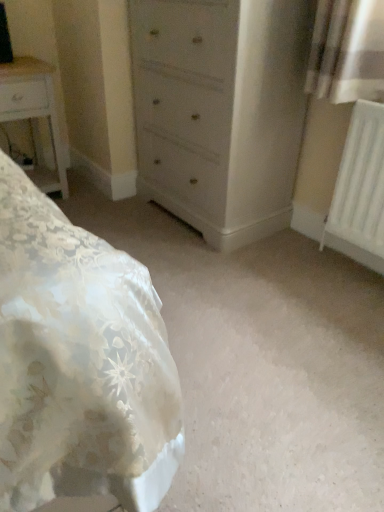
Question: From a real-world perspective, is white glossy nightstand at left below white plastic radiator at right?

Choices:
 (A) no
 (B) yes

Answer: (B)

Question: From the image's perspective, is white glossy nightstand at left under white plastic radiator at right?

Choices:
 (A) yes
 (B) no

Answer: (B)

Question: Considering the relative sizes of white glossy nightstand at left and white plastic radiator at right in the image provided, is white glossy nightstand at left bigger than white plastic radiator at right?

Choices:
 (A) yes
 (B) no

Answer: (A)

Question: Is white glossy nightstand at left outside white plastic radiator at right?

Choices:
 (A) no
 (B) yes

Answer: (B)

Question: Is white glossy nightstand at left smaller than white plastic radiator at right?

Choices:
 (A) yes
 (B) no

Answer: (B)

Question: Considering the positions of light gray wood chest of drawers at center and white plastic radiator at right in the image, is light gray wood chest of drawers at center taller or shorter than white plastic radiator at right?

Choices:
 (A) short
 (B) tall

Answer: (B)

Question: Does point (208, 91) appear closer or farther from the camera than point (367, 245)?

Choices:
 (A) farther
 (B) closer

Answer: (A)

Question: In terms of size, does light gray wood chest of drawers at center appear bigger or smaller than white plastic radiator at right?

Choices:
 (A) big
 (B) small

Answer: (A)

Question: From a real-world perspective, relative to white plastic radiator at right, is light gray wood chest of drawers at center vertically above or below?

Choices:
 (A) below
 (B) above

Answer: (B)

Question: From a real-world perspective, is white plastic radiator at right above or below light gray wood chest of drawers at center?

Choices:
 (A) above
 (B) below

Answer: (B)

Question: Is white plastic radiator at right taller or shorter than light gray wood chest of drawers at center?

Choices:
 (A) tall
 (B) short

Answer: (B)

Question: Considering the relative positions of white plastic radiator at right and light gray wood chest of drawers at center in the image provided, is white plastic radiator at right to the left or to the right of light gray wood chest of drawers at center?

Choices:
 (A) left
 (B) right

Answer: (B)

Question: From the image's perspective, is white plastic radiator at right above or below light gray wood chest of drawers at center?

Choices:
 (A) below
 (B) above

Answer: (A)

Question: Does point (253, 29) appear closer or farther from the camera than point (14, 57)?

Choices:
 (A) farther
 (B) closer

Answer: (B)

Question: Visually, is light gray wood chest of drawers at center positioned to the left or to the right of white glossy nightstand at left?

Choices:
 (A) left
 (B) right

Answer: (B)